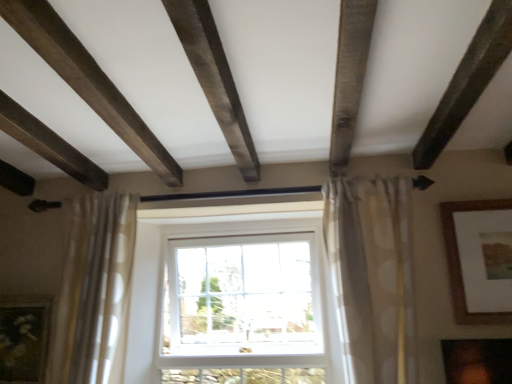
Question: Is point (76, 327) closer or farther from the camera than point (356, 41)?

Choices:
 (A) closer
 (B) farther

Answer: (B)

Question: In terms of height, does beige dotted fabric curtain at left, which is the 1th curtain from left to right, look taller or shorter compared to dark brown wood plank at upper center?

Choices:
 (A) tall
 (B) short

Answer: (A)

Question: Considering the real-world distances, which object is closest to the dark brown wood plank at upper center?

Choices:
 (A) brown wooden picture frame at upper right, positioned as the first picture frame in right-to-left order
 (B) matte gold picture frame at lower left, marked as the 1th picture frame in a bottom-to-top arrangement
 (C) beige dotted fabric curtain at left, which is the 1th curtain from left to right
 (D) white sheer curtain at center, the first curtain in the right-to-left sequence
 (E) white plastic window at center

Answer: (D)

Question: Based on their relative distances, which object is nearer to the white sheer curtain at center, which is the second curtain in left-to-right order?

Choices:
 (A) beige dotted fabric curtain at left, which appears as the 2th curtain when viewed from the right
 (B) white plastic window at center
 (C) brown wooden picture frame at upper right, acting as the 2th picture frame starting from the left
 (D) dark brown wood plank at upper center
 (E) matte gold picture frame at lower left, the first picture frame when ordered from left to right

Answer: (C)